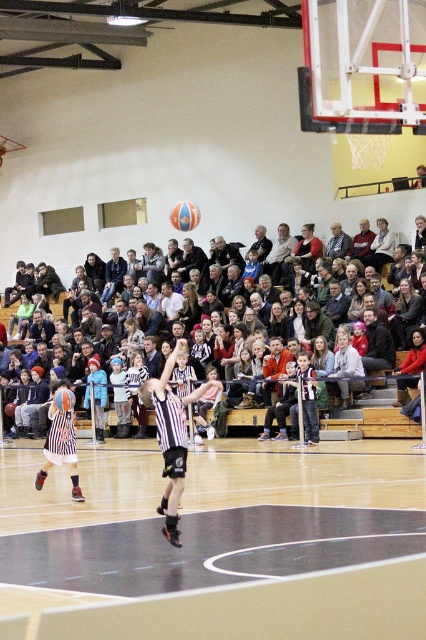
Can you confirm if dark blue jacket at center is positioned above orange textured basketball at center?

Yes.

From the picture: Can you confirm if dark blue jacket at center is positioned to the right of orange textured basketball at center?

In fact, dark blue jacket at center is to the left of orange textured basketball at center.

At what (x,y) coordinates should I click in order to perform the action: click on dark blue jacket at center. Please return your answer as a coordinate pair (x, y). The width and height of the screenshot is (426, 640). Looking at the image, I should click on (112, 275).

Does black jersey at center lie in front of striped jersey at center?

Yes, it is in front of striped jersey at center.

Which is more to the right, black jersey at center or striped jersey at center?

From the viewer's perspective, black jersey at center appears more on the right side.

The height and width of the screenshot is (640, 426). In order to click on black jersey at center in this screenshot , I will do `click(172, 436)`.

This screenshot has height=640, width=426. I want to click on black jersey at center, so click(x=172, y=436).

From the picture: Is matte black jacket at upper center to the right of striped jersey at center from the viewer's perspective?

Yes, matte black jacket at upper center is to the right of striped jersey at center.

Can you confirm if matte black jacket at upper center is positioned to the left of striped jersey at center?

No, matte black jacket at upper center is not to the left of striped jersey at center.

Between point (377, 428) and point (69, 426), which one is positioned behind?

Positioned behind is point (377, 428).

Find the location of a particular element. matte black jacket at upper center is located at coordinates (374, 426).